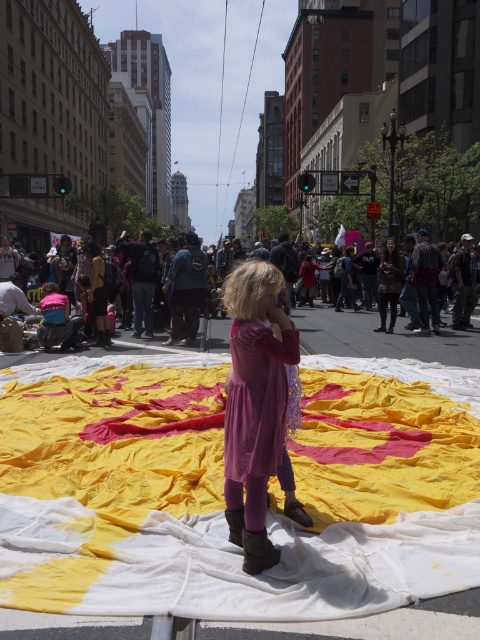
You are a photographer standing at the center of the street. You want to take a photo of both the young girl on the yellow fabric and the crowd in the midground. Which of the two points, point (298, 600) or point (466, 333), should you focus on first to ensure both subjects are in sharp focus?

Point (298, 600) is closer to the viewer than point (466, 333). To ensure both subjects are in sharp focus, focus on the closer point first, which is point (298, 600).

You are standing at the point with coordinates point [251,477] and want to move towards the point with coordinates point [456,461]. Which direction should you move to get closer to it?

You should move forward because point [456,461] is closer to the camera than point [251,477], so moving forward will bring you closer to it.

You are a photographer trying to capture a photo of the velvet purple dress at center and the matte pink dress at center. Which dress should you focus on first if you want to ensure both are in the frame without moving the camera?

The velvet purple dress at center is located below the matte pink dress at center, so you should focus on the matte pink dress at center first to ensure both are in the frame without moving the camera.